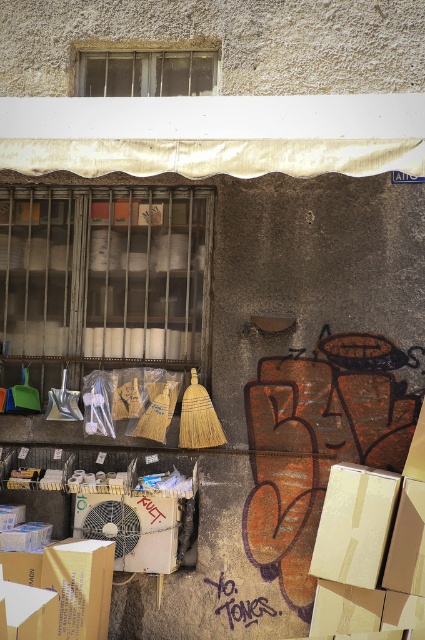
Does white cardboard box at center come in front of brown cardboard box at lower left?

Yes.

Which is behind, point (337, 518) or point (98, 580)?

Positioned behind is point (98, 580).

This screenshot has width=425, height=640. In order to click on white cardboard box at center in this screenshot , I will do `click(354, 524)`.